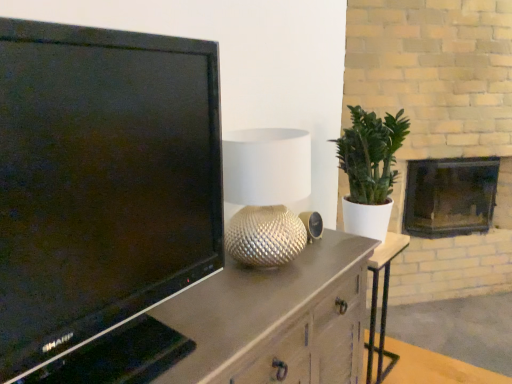
Question: Does point (420, 201) appear closer or farther from the camera than point (287, 233)?

Choices:
 (A) closer
 (B) farther

Answer: (B)

Question: From the image's perspective, is dark gray stone fireplace at right above or below silver textured lamp at center?

Choices:
 (A) above
 (B) below

Answer: (A)

Question: Estimate the real-world distances between objects in this image. Which object is closer to the matte brown cabinet at left?

Choices:
 (A) black glossy television at left
 (B) dark gray stone fireplace at right
 (C) silver textured lamp at center
 (D) green matte plant at right
 (E) metallic silver side table at center

Answer: (C)

Question: Which object is the farthest from the silver textured lamp at center?

Choices:
 (A) matte brown cabinet at left
 (B) black glossy television at left
 (C) metallic silver side table at center
 (D) dark gray stone fireplace at right
 (E) green matte plant at right

Answer: (D)